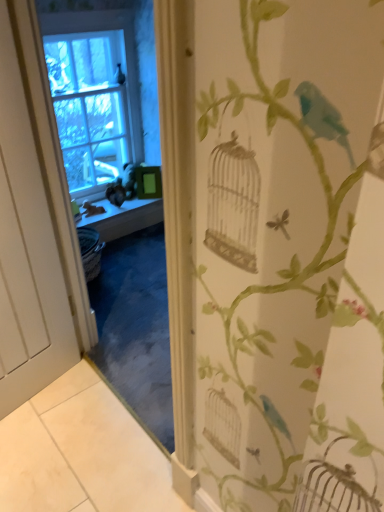
The height and width of the screenshot is (512, 384). Find the location of `empty space that is ontop of smooth wooden window sill at center (from a real-world perspective)`. empty space that is ontop of smooth wooden window sill at center (from a real-world perspective) is located at coordinates (115, 203).